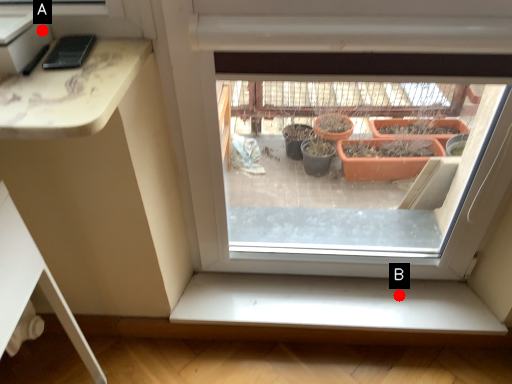
Question: Two points are circled on the image, labeled by A and B beside each circle. Which of the following is the closest to the observer?

Choices:
 (A) A is closer
 (B) B is closer

Answer: (A)